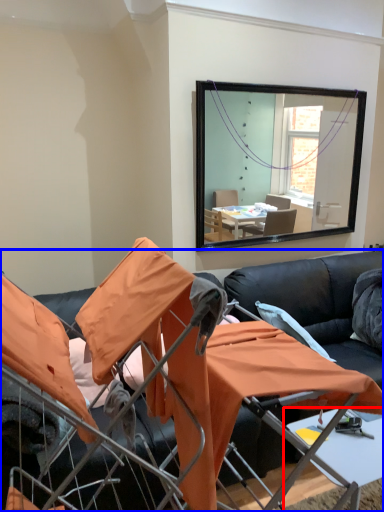
Question: Which object is further to the camera taking this photo, table (highlighted by a red box) or studio couch (highlighted by a blue box)?

Choices:
 (A) table
 (B) studio couch

Answer: (A)